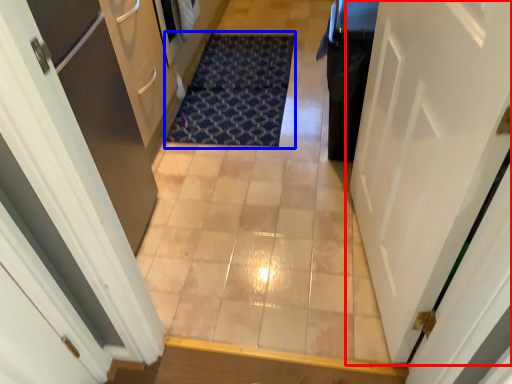
Question: Among these objects, which one is nearest to the camera, door (highlighted by a red box) or doormat (highlighted by a blue box)?

Choices:
 (A) door
 (B) doormat

Answer: (A)